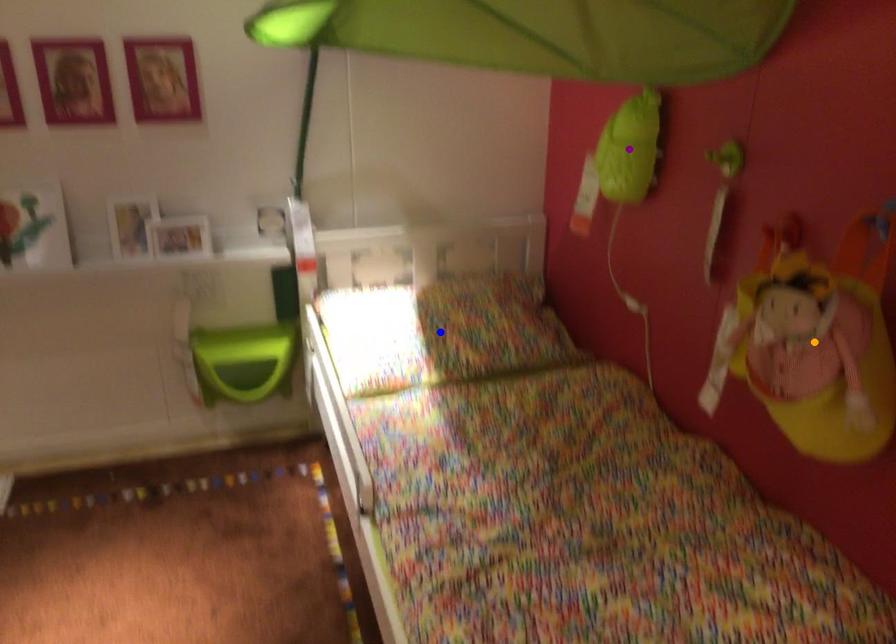
Order these from farthest to nearest:
- blue point
- purple point
- orange point

blue point, purple point, orange point